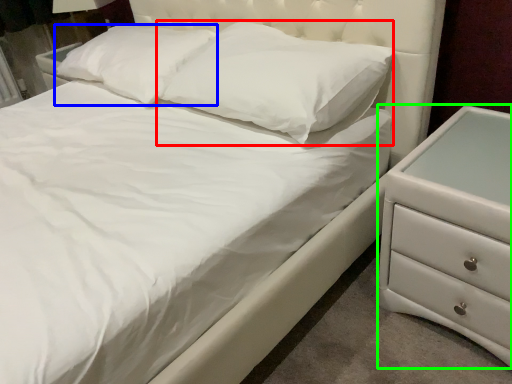
Question: Which object is positioned farthest from pillow (highlighted by a red box)? Select from pillow (highlighted by a blue box) and chest of drawers (highlighted by a green box).

Choices:
 (A) pillow
 (B) chest of drawers

Answer: (B)